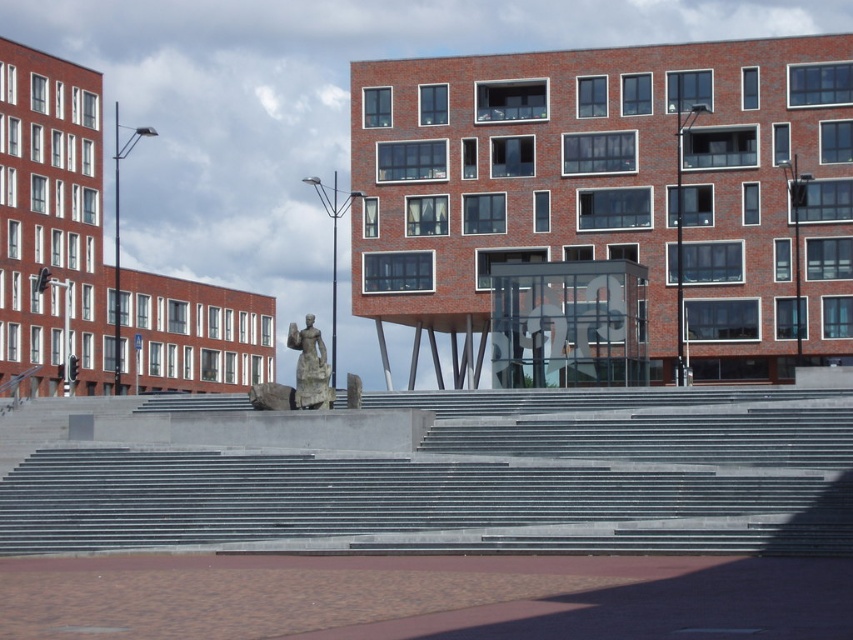
This screenshot has height=640, width=853. What do you see at coordinates (476, 481) in the screenshot?
I see `smooth concrete stairs at center` at bounding box center [476, 481].

The image size is (853, 640). Find the location of `smooth concrete stairs at center`. smooth concrete stairs at center is located at coordinates (476, 481).

Which is behind, point (712, 404) or point (306, 376)?

Positioned behind is point (712, 404).

Locate an element on the screen. smooth concrete stairs at center is located at coordinates (476, 481).

Who is more forward, [456,522] or [350,387]?

Point [456,522]

Image resolution: width=853 pixels, height=640 pixels. Identify the location of smooth concrete stairs at center. (476, 481).

Find the location of `smooth concrete stairs at center`. smooth concrete stairs at center is located at coordinates (476, 481).

Does bronze statue at center appear over polished bronze statue at center?

Correct, bronze statue at center is located above polished bronze statue at center.

Who is taller, bronze statue at center or polished bronze statue at center?

polished bronze statue at center is taller.

Identify the location of bronze statue at center. (299, 376).